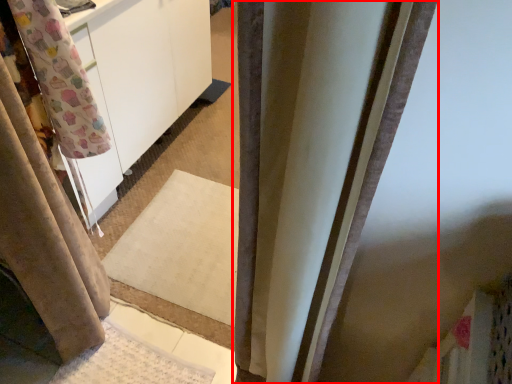
Question: Where is curtain (annotated by the red box) located in relation to curtain in the image?

Choices:
 (A) right
 (B) left

Answer: (A)